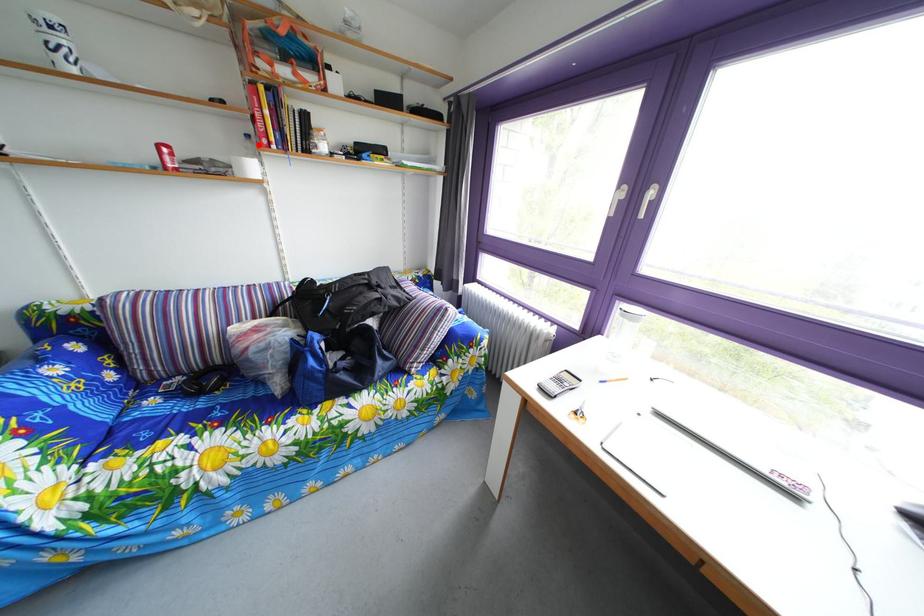
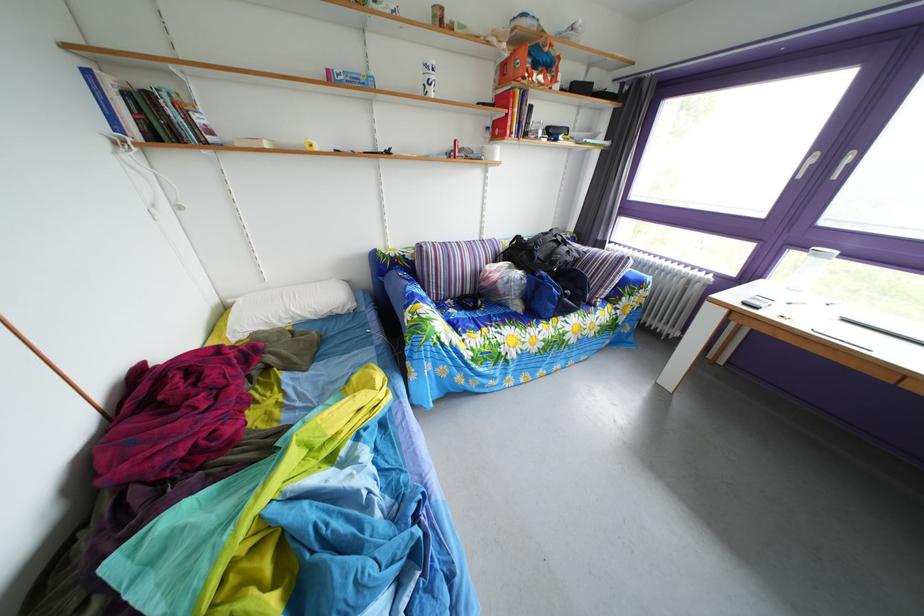
Question: A red point is marked in image1. In image2, is the corresponding 3D point closer to the camera or farther? Reply with the corresponding letter.

Choices:
 (A) The corresponding 3D point is closer.
 (B) The corresponding 3D point is farther.

Answer: (A)